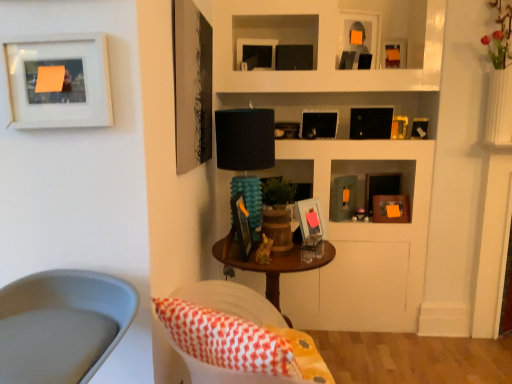
Locate an element on the screen. The image size is (512, 384). matte black picture frame at center, acting as the tenth picture frame starting from the back is located at coordinates (241, 225).

What do you see at coordinates (58, 81) in the screenshot?
I see `matte white picture frame at upper left, acting as the 11th picture frame starting from the back` at bounding box center [58, 81].

The width and height of the screenshot is (512, 384). What do you see at coordinates (380, 187) in the screenshot?
I see `matte black picture frame at center, the 1th picture frame from the back` at bounding box center [380, 187].

The width and height of the screenshot is (512, 384). I want to click on black matte picture frame at upper center, arranged as the 7th picture frame when viewed from the front, so click(371, 123).

Identify the location of teal textured lamp at center. Image resolution: width=512 pixels, height=384 pixels. (245, 139).

How much distance is there between black matte picture frame at upper center, placed as the 5th picture frame when sorted from back to front, and matte white picture frame at upper left, the first picture frame from the front?

They are 1.80 meters apart.

From a real-world perspective, is black matte picture frame at upper center, placed as the 5th picture frame when sorted from back to front, positioned under matte white picture frame at upper left, acting as the 11th picture frame starting from the back, based on gravity?

Yes, from a real-world perspective, black matte picture frame at upper center, placed as the 5th picture frame when sorted from back to front, is under matte white picture frame at upper left, acting as the 11th picture frame starting from the back.

Is black matte picture frame at upper center, arranged as the 7th picture frame when viewed from the front, surrounding matte white picture frame at upper left, acting as the 11th picture frame starting from the back?

No.

Is metallic gold picture frame at upper right, the sixth picture frame in the front-to-back sequence, bigger or smaller than matte black picture frame at center, acting as the tenth picture frame starting from the back?

metallic gold picture frame at upper right, the sixth picture frame in the front-to-back sequence, is smaller than matte black picture frame at center, acting as the tenth picture frame starting from the back.

Is metallic gold picture frame at upper right, the sixth picture frame in the back-to-front sequence, placed right next to matte black picture frame at center, acting as the tenth picture frame starting from the back?

No, metallic gold picture frame at upper right, the sixth picture frame in the back-to-front sequence, is not next to matte black picture frame at center, acting as the tenth picture frame starting from the back.

Considering the positions of objects teal textured lamp at center and matte white picture frame at upper left, the first picture frame from the front, in the image provided, who is more to the right, teal textured lamp at center or matte white picture frame at upper left, the first picture frame from the front,?

Positioned to the right is teal textured lamp at center.

Considering the relative sizes of teal textured lamp at center and matte white picture frame at upper left, acting as the 11th picture frame starting from the back, in the image provided, is teal textured lamp at center wider than matte white picture frame at upper left, acting as the 11th picture frame starting from the back,?

Indeed, teal textured lamp at center has a greater width compared to matte white picture frame at upper left, acting as the 11th picture frame starting from the back.

Is teal textured lamp at center smaller than matte white picture frame at upper left, the first picture frame from the front?

Actually, teal textured lamp at center might be larger than matte white picture frame at upper left, the first picture frame from the front.

Is the position of teal textured lamp at center less distant than that of matte white picture frame at upper left, the first picture frame from the front?

No, the depth of teal textured lamp at center is greater than that of matte white picture frame at upper left, the first picture frame from the front.

Is point (395, 125) closer to camera compared to point (423, 121)?

No, it is not.

Who is bigger, metallic gold picture frame at upper right, arranged as the eighth picture frame when viewed from the front, or metallic gold picture frame at upper right, the sixth picture frame in the front-to-back sequence?

metallic gold picture frame at upper right, arranged as the eighth picture frame when viewed from the front.

Who is shorter, metallic gold picture frame at upper right, arranged as the eighth picture frame when viewed from the front, or metallic gold picture frame at upper right, the sixth picture frame in the back-to-front sequence?

metallic gold picture frame at upper right, the sixth picture frame in the back-to-front sequence.

Does metallic gold picture frame at upper right, the 4th picture frame viewed from the back, have a lesser width compared to metallic gold picture frame at upper right, the sixth picture frame in the back-to-front sequence?

No, metallic gold picture frame at upper right, the 4th picture frame viewed from the back, is not thinner than metallic gold picture frame at upper right, the sixth picture frame in the back-to-front sequence.

Is metallic gold picture frame at upper right, the sixth picture frame in the front-to-back sequence, turned away from matte white picture frame at upper left, the first picture frame from the front?

No, metallic gold picture frame at upper right, the sixth picture frame in the front-to-back sequence, is not facing the opposite direction of matte white picture frame at upper left, the first picture frame from the front.

Can you confirm if metallic gold picture frame at upper right, the sixth picture frame in the front-to-back sequence, is positioned to the right of matte white picture frame at upper left, the first picture frame from the front?

Indeed, metallic gold picture frame at upper right, the sixth picture frame in the front-to-back sequence, is positioned on the right side of matte white picture frame at upper left, the first picture frame from the front.

Can you confirm if metallic gold picture frame at upper right, the sixth picture frame in the front-to-back sequence, is wider than matte white picture frame at upper left, the first picture frame from the front?

Correct, the width of metallic gold picture frame at upper right, the sixth picture frame in the front-to-back sequence, exceeds that of matte white picture frame at upper left, the first picture frame from the front.

Can you tell me how much metallic gold picture frame at upper right, the sixth picture frame in the front-to-back sequence, and matte white picture frame at upper left, acting as the 11th picture frame starting from the back, differ in facing direction?

metallic gold picture frame at upper right, the sixth picture frame in the front-to-back sequence, and matte white picture frame at upper left, acting as the 11th picture frame starting from the back, are facing 6.96 degrees away from each other.

The width and height of the screenshot is (512, 384). In order to click on picture frame on the left side of smooth gray swivel chair at lower left in this screenshot , I will do point(58,81).

Is smooth gray swivel chair at lower left wider than matte white picture frame at upper left, the first picture frame from the front?

Yes.

Is smooth gray swivel chair at lower left behind matte white picture frame at upper left, the first picture frame from the front?

No, smooth gray swivel chair at lower left is in front of matte white picture frame at upper left, the first picture frame from the front.

How many degrees apart are the facing directions of smooth gray swivel chair at lower left and matte white picture frame at upper left, acting as the 11th picture frame starting from the back?

They differ by 15.5 degrees in their facing directions.

Relative to black matte picture frame at upper center, arranged as the 7th picture frame when viewed from the front, is matte black picture frame at center, which ranks as the eleventh picture frame in front-to-back order, in front or behind?

In the image, matte black picture frame at center, which ranks as the eleventh picture frame in front-to-back order, appears behind black matte picture frame at upper center, arranged as the 7th picture frame when viewed from the front.

Considering the relative sizes of matte black picture frame at center, which ranks as the eleventh picture frame in front-to-back order, and black matte picture frame at upper center, arranged as the 7th picture frame when viewed from the front, in the image provided, is matte black picture frame at center, which ranks as the eleventh picture frame in front-to-back order, shorter than black matte picture frame at upper center, arranged as the 7th picture frame when viewed from the front,?

No, matte black picture frame at center, which ranks as the eleventh picture frame in front-to-back order, is not shorter than black matte picture frame at upper center, arranged as the 7th picture frame when viewed from the front.

What's the angular difference between matte black picture frame at center, which ranks as the eleventh picture frame in front-to-back order, and black matte picture frame at upper center, arranged as the 7th picture frame when viewed from the front,'s facing directions?

The facing directions of matte black picture frame at center, which ranks as the eleventh picture frame in front-to-back order, and black matte picture frame at upper center, arranged as the 7th picture frame when viewed from the front, are 5.15 degrees apart.

Is matte black picture frame at center, which ranks as the eleventh picture frame in front-to-back order, oriented away from black matte picture frame at upper center, arranged as the 7th picture frame when viewed from the front?

No.

I want to click on the 3rd picture frame below the black matte picture frame at upper center, arranged as the 7th picture frame when viewed from the front (from the image's perspective), so click(58, 81).

Which picture frame is the 9th one when counting from the right side of the matte black picture frame at center, acting as the tenth picture frame starting from the back? Please provide its 2D coordinates.

[(420, 128)]

Which object lies further to the anchor point matte black picture frame at upper center, which is counted as the 4th picture frame, starting from the front, metallic gold picture frame at upper right, the sixth picture frame in the front-to-back sequence, or matte white picture frame at upper left, the first picture frame from the front?

matte white picture frame at upper left, the first picture frame from the front, lies further to matte black picture frame at upper center, which is counted as the 4th picture frame, starting from the front, than the other object.

Which object lies nearer to the anchor point orange matte picture frame at upper right, placed as the 3th picture frame when sorted from back to front, black matte picture frame at upper center, arranged as the 7th picture frame when viewed from the front, or metallic gold picture frame at upper right, the sixth picture frame in the front-to-back sequence?

Among the two, metallic gold picture frame at upper right, the sixth picture frame in the front-to-back sequence, is located nearer to orange matte picture frame at upper right, placed as the 3th picture frame when sorted from back to front.

Which object lies further to the anchor point orange matte picture frame at upper right, acting as the ninth picture frame starting from the front, matte white picture frame at upper left, acting as the 11th picture frame starting from the back, or metallic gold picture frame at upper right, the sixth picture frame in the back-to-front sequence?

The object further to orange matte picture frame at upper right, acting as the ninth picture frame starting from the front, is matte white picture frame at upper left, acting as the 11th picture frame starting from the back.

Which object lies further to the anchor point smooth gray swivel chair at lower left, metallic gold picture frame at upper right, arranged as the eighth picture frame when viewed from the front, or matte black picture frame at upper center, acting as the 3th picture frame starting from the front?

Among the two, metallic gold picture frame at upper right, arranged as the eighth picture frame when viewed from the front, is located further to smooth gray swivel chair at lower left.

Which object lies nearer to the anchor point orange matte picture frame at upper right, placed as the 3th picture frame when sorted from back to front, metallic gold picture frame at upper right, arranged as the eighth picture frame when viewed from the front, or matte black picture frame at upper center, acting as the 3th picture frame starting from the front?

Based on the image, metallic gold picture frame at upper right, arranged as the eighth picture frame when viewed from the front, appears to be nearer to orange matte picture frame at upper right, placed as the 3th picture frame when sorted from back to front.

Considering their positions, is metallic gold picture frame at upper right, the 4th picture frame viewed from the back, positioned closer to matte black picture frame at upper center, acting as the 8th picture frame starting from the back, than black matte picture frame at upper center, arranged as the 7th picture frame when viewed from the front?

black matte picture frame at upper center, arranged as the 7th picture frame when viewed from the front, is closer to matte black picture frame at upper center, acting as the 8th picture frame starting from the back.

Looking at the image, which one is located further to metallic gold picture frame at upper right, the sixth picture frame in the back-to-front sequence, orange matte picture frame at upper right, placed as the 3th picture frame when sorted from back to front, or white fabric chair at lower left?

The object further to metallic gold picture frame at upper right, the sixth picture frame in the back-to-front sequence, is white fabric chair at lower left.

Looking at the image, which one is located further to white fabric chair at lower left, matte black picture frame at upper right, which is the 7th picture frame from back to front, or matte black picture frame at center, the 1th picture frame from the back?

matte black picture frame at upper right, which is the 7th picture frame from back to front, is positioned further to the anchor white fabric chair at lower left.

This screenshot has height=384, width=512. In order to click on table lamp located between smooth gray swivel chair at lower left and metallic gold picture frame at upper right, the 4th picture frame viewed from the back, in the depth direction in this screenshot , I will do `click(245, 139)`.

Find the location of `table lamp between matte black picture frame at upper right, which ranks as the 5th picture frame in front-to-back order, and matte black picture frame at center, which ranks as the eleventh picture frame in front-to-back order, in the up-down direction`. table lamp between matte black picture frame at upper right, which ranks as the 5th picture frame in front-to-back order, and matte black picture frame at center, which ranks as the eleventh picture frame in front-to-back order, in the up-down direction is located at coordinates (245, 139).

Image resolution: width=512 pixels, height=384 pixels. Identify the location of picture frame located between white fabric chair at lower left and matte black picture frame at center, acting as the tenth picture frame starting from the back, in the depth direction. (58, 81).

At what (x,y) coordinates should I click in order to perform the action: click on table lamp between white fabric chair at lower left and matte black picture frame at upper center, the tenth picture frame when ordered from front to back, from front to back. Please return your answer as a coordinate pair (x, y). Image resolution: width=512 pixels, height=384 pixels. Looking at the image, I should click on (245, 139).